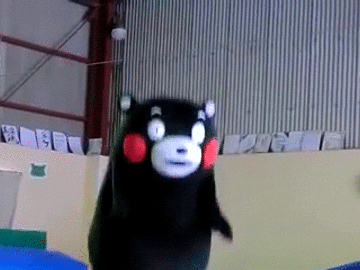
Find the location of a particular element. The height and width of the screenshot is (270, 360). right side of wall is located at coordinates (286, 72).